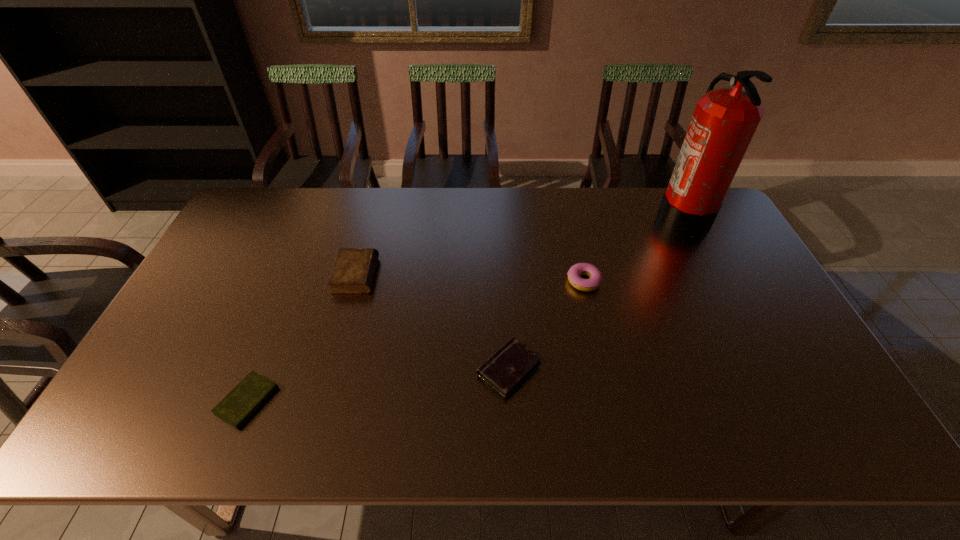
At what (x,y) coordinates should I click in order to perform the action: click on vacant space that is in between the shortest diary and the rightmost object. Please return your answer as a coordinate pair (x, y). The width and height of the screenshot is (960, 540). Looking at the image, I should click on (466, 308).

Image resolution: width=960 pixels, height=540 pixels. I want to click on unoccupied position between the second diary from left to right and the second shortest diary, so click(x=433, y=322).

You are a GUI agent. You are given a task and a screenshot of the screen. Output one action in this format:
    pyautogui.click(x=<x>, y=<y>)
    Task: Click on the empty location between the second shortest object and the leftmost diary
    The image size is (960, 540).
    Given the screenshot: What is the action you would take?
    pyautogui.click(x=378, y=384)

You are a GUI agent. You are given a task and a screenshot of the screen. Output one action in this format:
    pyautogui.click(x=<x>, y=<y>)
    Task: Click on the empty location between the leftmost object and the third object from right to left
    This screenshot has width=960, height=540.
    Given the screenshot: What is the action you would take?
    pyautogui.click(x=378, y=384)

This screenshot has height=540, width=960. I want to click on empty location between the tallest object and the tallest diary, so click(x=519, y=245).

What are the coordinates of `object that is the fourth closest to the farthest diary` in the screenshot? It's located at (724, 121).

You are a GUI agent. You are given a task and a screenshot of the screen. Output one action in this format:
    pyautogui.click(x=<x>, y=<y>)
    Task: Click on the third closest object relative to the rightmost diary
    The image size is (960, 540).
    Given the screenshot: What is the action you would take?
    pyautogui.click(x=241, y=403)

At what (x,y) coordinates should I click in order to perform the action: click on diary that can be found as the closest to the fourth object from right to left. Please return your answer as a coordinate pair (x, y). The height and width of the screenshot is (540, 960). Looking at the image, I should click on (241, 403).

The height and width of the screenshot is (540, 960). In order to click on diary that stands as the second closest to the doughnut in this screenshot , I will do `click(353, 271)`.

Where is `vacant region that satisfies the following two spatial constraints: 1. on the front side of the fire extinguisher; 2. on the front side of the shortest diary`? This screenshot has height=540, width=960. vacant region that satisfies the following two spatial constraints: 1. on the front side of the fire extinguisher; 2. on the front side of the shortest diary is located at coordinates (779, 401).